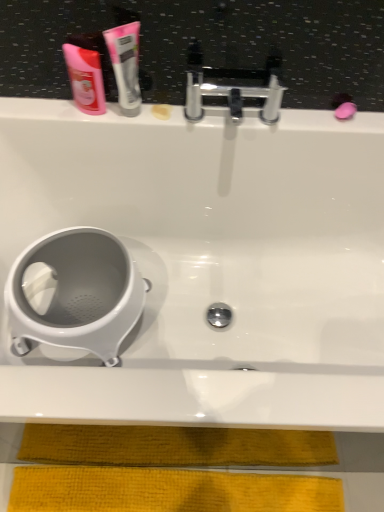
This screenshot has width=384, height=512. Identify the location of vacant area located to the right-hand side of polished chrome faucet at upper center. (308, 124).